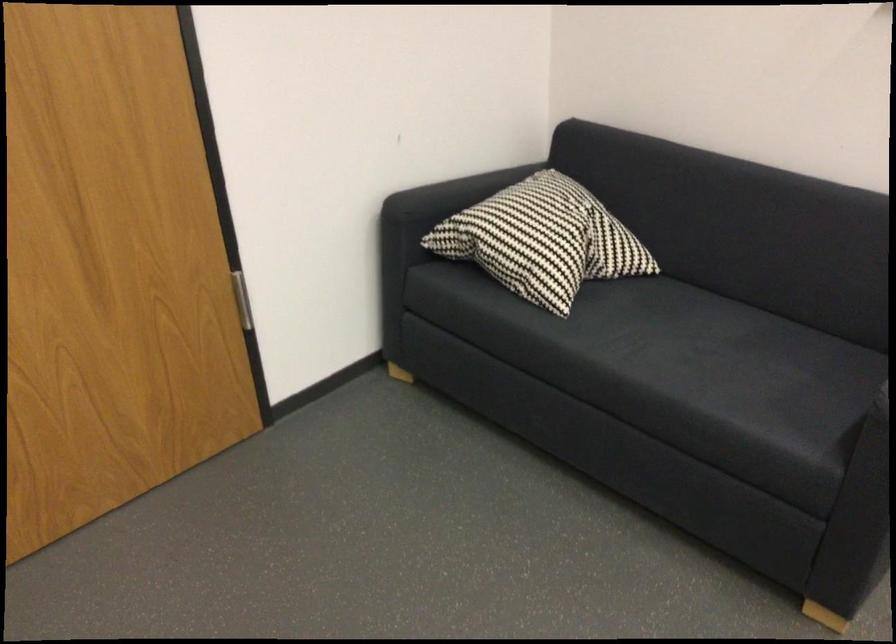
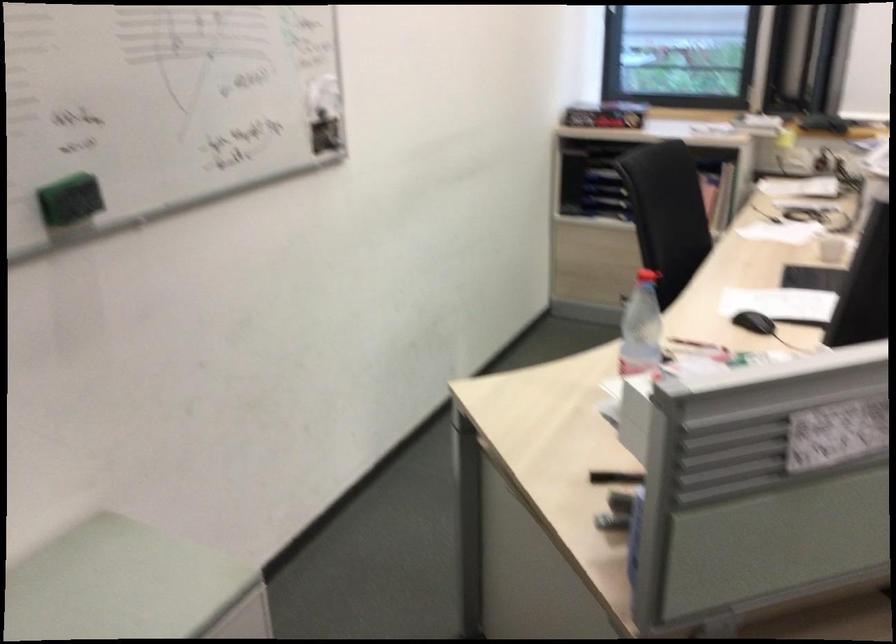
The images are taken continuously from a first-person perspective. In which direction is your viewpoint rotating?

The rotation direction of the camera is right-down.